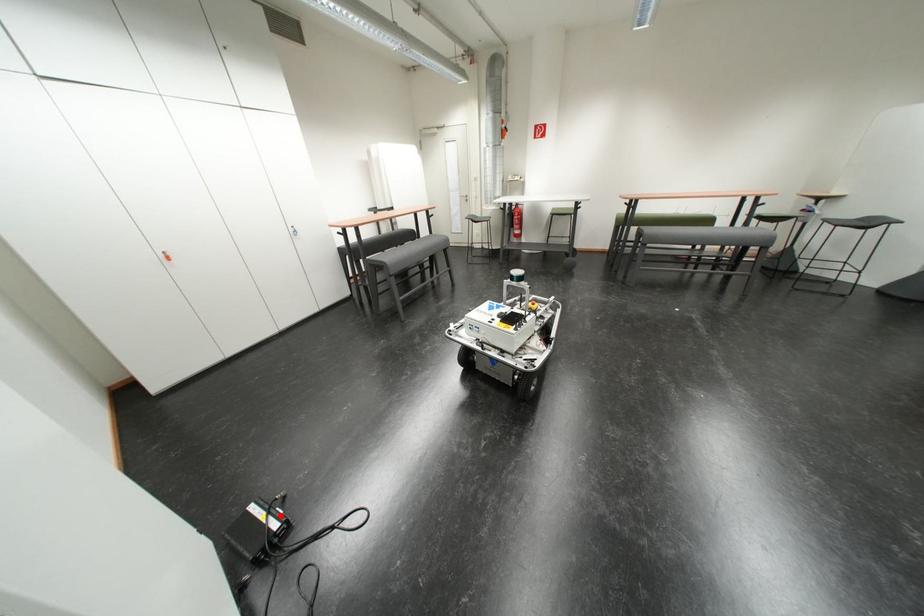
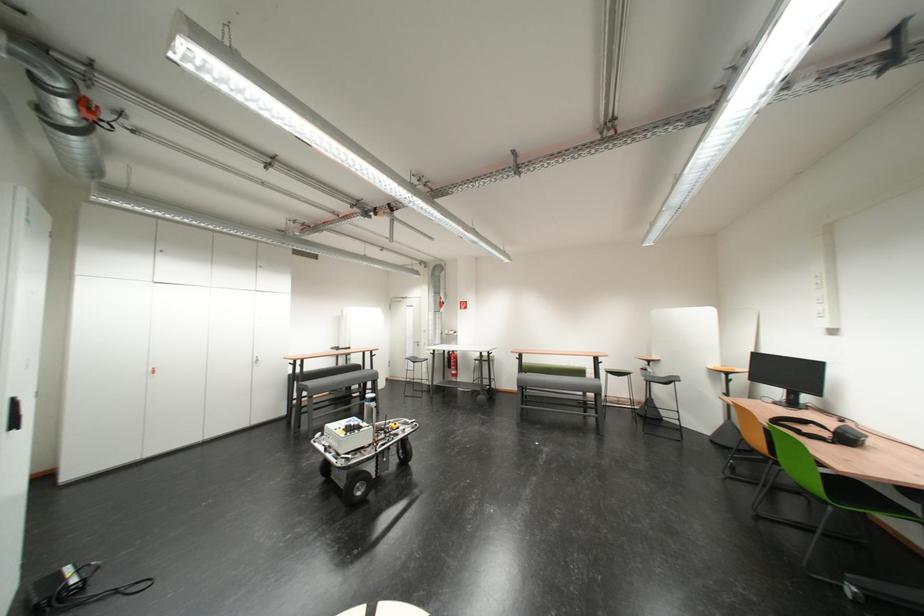
Locate, in the second image, the point that corresponds to the highlighted location in the first image.

(90, 573)